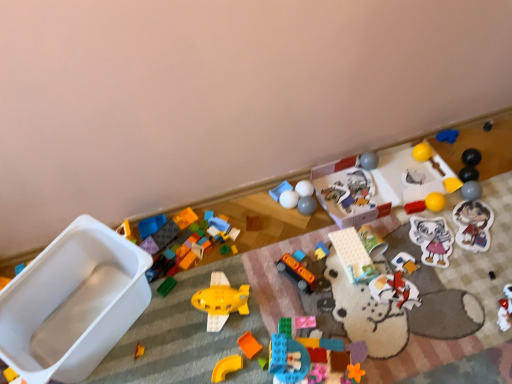
You are a GUI agent. You are given a task and a screenshot of the screen. Output one action in this format:
    pyautogui.click(x=<x>, y=<y>)
    Task: Click on the vacant space in between orange matte block at center, acting as the sixth toy starting from the left, and matte gray ball at right, which appears as the 24th toy when viewed from the left
    
    Given the screenshot: What is the action you would take?
    pyautogui.click(x=377, y=261)